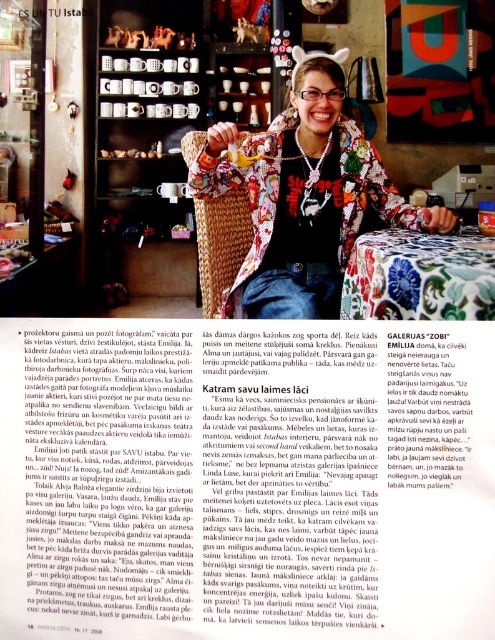
Question: Which of the following is the closest to the observer?

Choices:
 (A) smooth brown bread at center
 (B) blacktextured fabricmagazine at center
 (C) floral fabric jacket at center

Answer: (B)

Question: Is blacktextured fabricmagazine at center further to camera compared to smooth brown bread at center?

Choices:
 (A) no
 (B) yes

Answer: (A)

Question: Does blacktextured fabricmagazine at center have a smaller size compared to smooth brown bread at center?

Choices:
 (A) no
 (B) yes

Answer: (B)

Question: Which of the following is the closest to the observer?

Choices:
 (A) (306, 612)
 (B) (133, 154)
 (C) (314, 148)

Answer: (A)

Question: Does blacktextured fabricmagazine at center appear under smooth brown bread at center?

Choices:
 (A) yes
 (B) no

Answer: (A)

Question: Considering the real-world distances, which object is farthest from the floral fabric jacket at center?

Choices:
 (A) blacktextured fabricmagazine at center
 (B) smooth brown bread at center

Answer: (B)